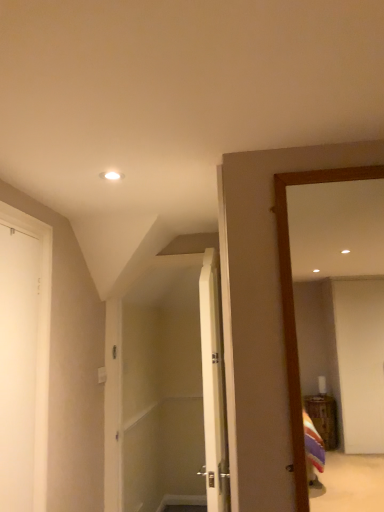
Question: From the image's perspective, is wooden mirror at right under white matte door at left, the 1th door viewed from the left?

Choices:
 (A) no
 (B) yes

Answer: (A)

Question: Could you tell me if wooden mirror at right is facing white matte door at left, positioned as the 2th door in right-to-left order?

Choices:
 (A) yes
 (B) no

Answer: (B)

Question: Is the position of wooden mirror at right less distant than that of white matte door at left, acting as the second door starting from the back?

Choices:
 (A) no
 (B) yes

Answer: (B)

Question: Does wooden mirror at right have a greater height compared to white matte door at left, positioned as the 2th door in right-to-left order?

Choices:
 (A) no
 (B) yes

Answer: (A)

Question: From a real-world perspective, is wooden mirror at right positioned under white matte door at left, positioned as the 2th door in right-to-left order, based on gravity?

Choices:
 (A) yes
 (B) no

Answer: (B)

Question: From their relative heights in the image, would you say white matte door at left, positioned as the 2th door in right-to-left order, is taller or shorter than white wood door at center, the 1th door from the right?

Choices:
 (A) tall
 (B) short

Answer: (B)

Question: Looking at their shapes, would you say white matte door at left, acting as the second door starting from the back, is wider or thinner than white wood door at center, the 1th door from the right?

Choices:
 (A) wide
 (B) thin

Answer: (B)

Question: Based on their sizes in the image, would you say white matte door at left, acting as the second door starting from the back, is bigger or smaller than white wood door at center, which is the first door in back-to-front order?

Choices:
 (A) big
 (B) small

Answer: (B)

Question: From the image's perspective, is white matte door at left, positioned as the 2th door in right-to-left order, located above or below white wood door at center, which is the 2th door from front to back?

Choices:
 (A) below
 (B) above

Answer: (B)

Question: Considering the positions of white matte door at left, acting as the second door starting from the back, and wooden mirror at right in the image, is white matte door at left, acting as the second door starting from the back, wider or thinner than wooden mirror at right?

Choices:
 (A) thin
 (B) wide

Answer: (A)

Question: Is white matte door at left, which is the 1th door from front to back, in front of or behind wooden mirror at right in the image?

Choices:
 (A) front
 (B) behind

Answer: (B)

Question: Considering the positions of point (11, 282) and point (299, 493), is point (11, 282) closer or farther from the camera than point (299, 493)?

Choices:
 (A) closer
 (B) farther

Answer: (B)

Question: In terms of height, does white matte door at left, positioned as the 2th door in right-to-left order, look taller or shorter compared to wooden mirror at right?

Choices:
 (A) short
 (B) tall

Answer: (B)

Question: Is white wood door at center, which is the 2th door from front to back, wider or thinner than wooden mirror at right?

Choices:
 (A) thin
 (B) wide

Answer: (B)

Question: Considering the positions of point (210, 324) and point (375, 174), is point (210, 324) closer or farther from the camera than point (375, 174)?

Choices:
 (A) closer
 (B) farther

Answer: (B)